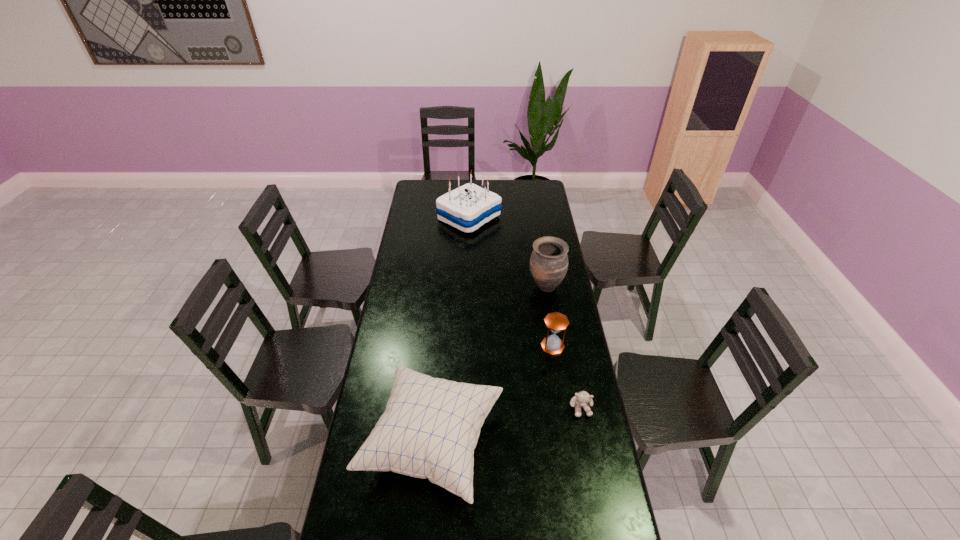
This screenshot has height=540, width=960. What are the coordinates of `free location that satisfies the following two spatial constraints: 1. on the front side of the third farthest object; 2. on the right side of the farthest object` in the screenshot? It's located at (466, 346).